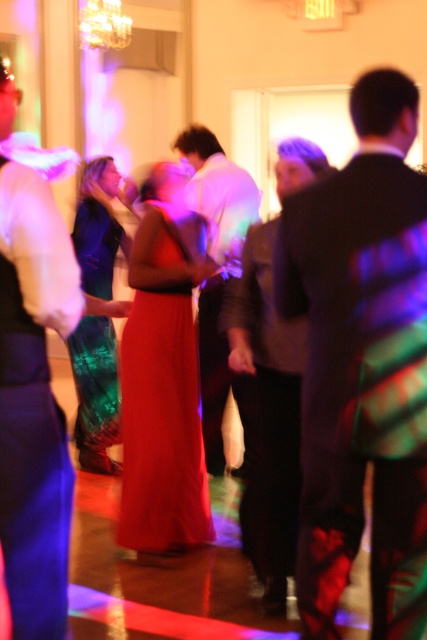
You are organizing a photo shoot and need to place two mannequins wearing the shiny black suit at center and the matte white shirt at left. Given their sizes, which mannequin requires a wider space to accommodate its width?

The shiny black suit at center requires a wider space because its width is larger than the matte white shirt at left.

You are standing in the middle of the room at the party scene. There are two points marked in the image. Which point is nearer to you, point (37,499) or point (228,252)?

Point (37,499) is closer to the viewer than point (228,252).